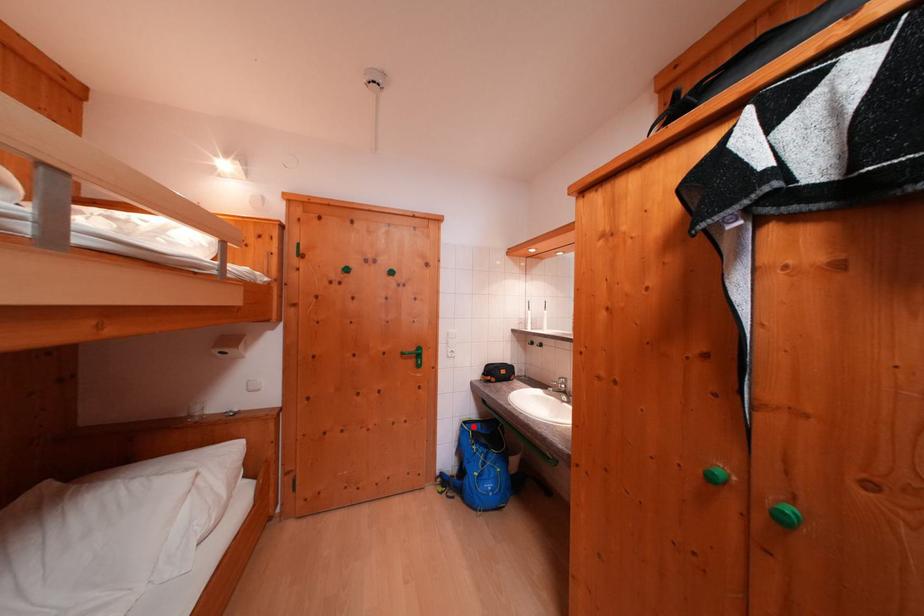
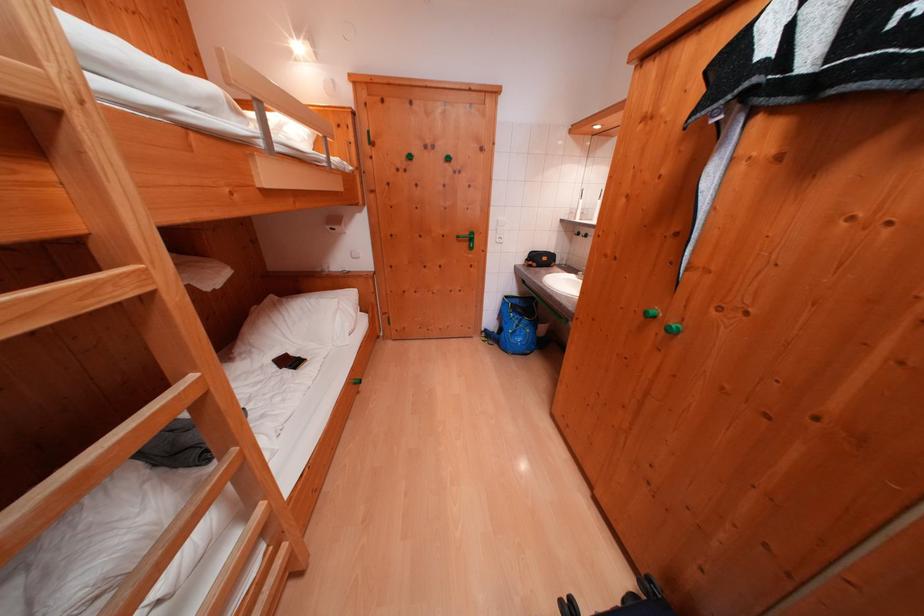
The point at the highlighted location is marked in the first image. Where is the corresponding point in the second image?

(515, 301)